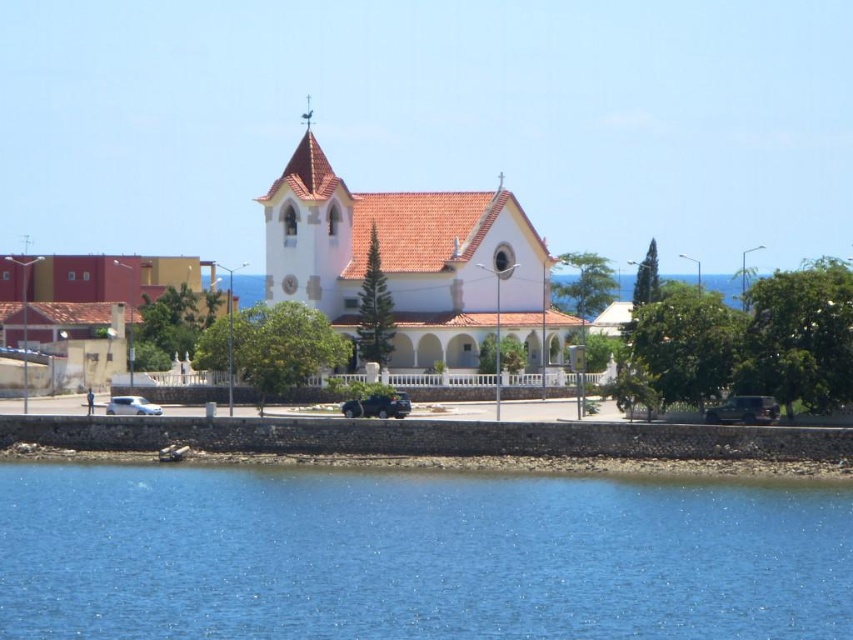
You are a tourist standing on the road near the white stucco church at center. You want to take a photo of the church with the blue liquid water at lower center in the foreground. Will the water be visible in the photo if you position yourself so that the church is the main focus?

The blue liquid water at lower center is not as tall as the white stucco church at center, so yes, the water will be visible in the photo as it is lower in height compared to the church, allowing it to appear in the foreground when focusing on the church.